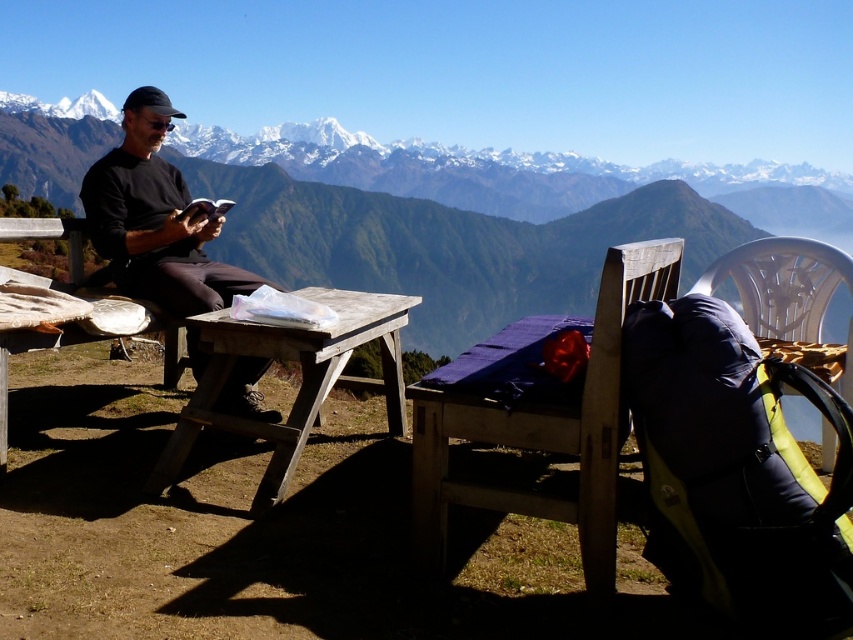
Question: Which point appears farthest from the camera in this image?

Choices:
 (A) (332, 284)
 (B) (320, 289)
 (C) (579, 444)
 (D) (33, 280)

Answer: (A)

Question: Does wooden picnic table at center have a greater width compared to white plastic chair at right?

Choices:
 (A) yes
 (B) no

Answer: (A)

Question: Is wooden picnic table at center to the right of wooden picnic table at lower left from the viewer's perspective?

Choices:
 (A) yes
 (B) no

Answer: (A)

Question: Which object is the farthest from the wooden chair at center?

Choices:
 (A) black matte shirt at left
 (B) snowy mountain range at upper center
 (C) wooden picnic table at center
 (D) wooden picnic table at lower left

Answer: (B)

Question: Which point is closer to the camera?

Choices:
 (A) (511, 282)
 (B) (3, 432)

Answer: (B)

Question: Is wooden chair at center positioned behind wooden picnic table at lower left?

Choices:
 (A) yes
 (B) no

Answer: (B)